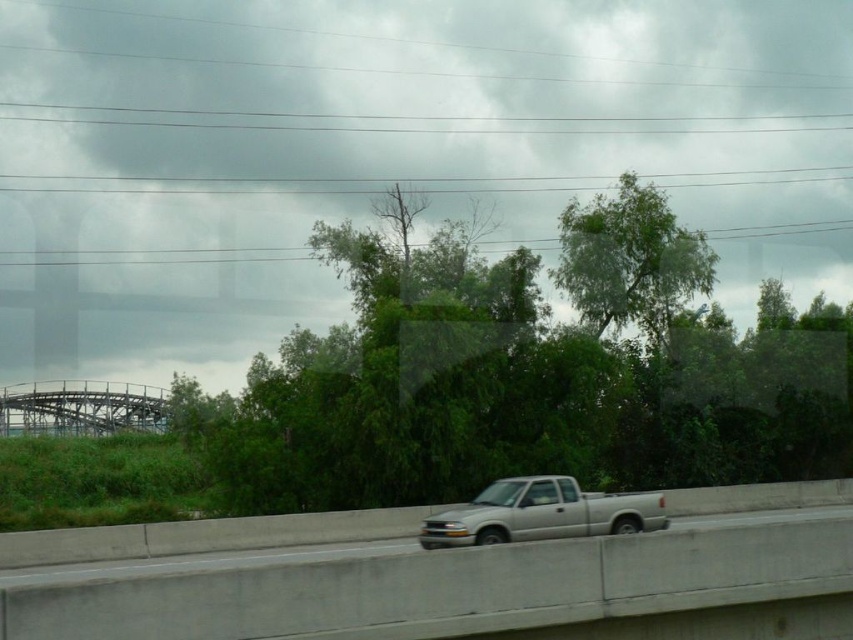
You are a passenger in the silver metallic truck at center and want to know if the green leafy tree at center is blocking your view of the road ahead. Based on their positions, can you determine if the tree is obscuring your view?

The green leafy tree at center is located above the silver metallic truck at center, so it is positioned in a way that does not block the driver or passenger from seeing the road ahead. The tree is likely above the truck, so it would not obstruct forward visibility.